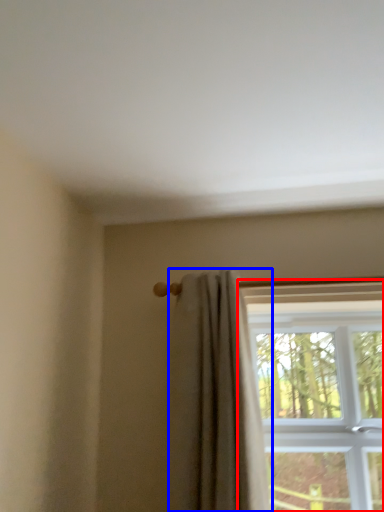
Question: Which object appears closest to the camera in this image, window (highlighted by a red box) or curtain (highlighted by a blue box)?

Choices:
 (A) window
 (B) curtain

Answer: (B)